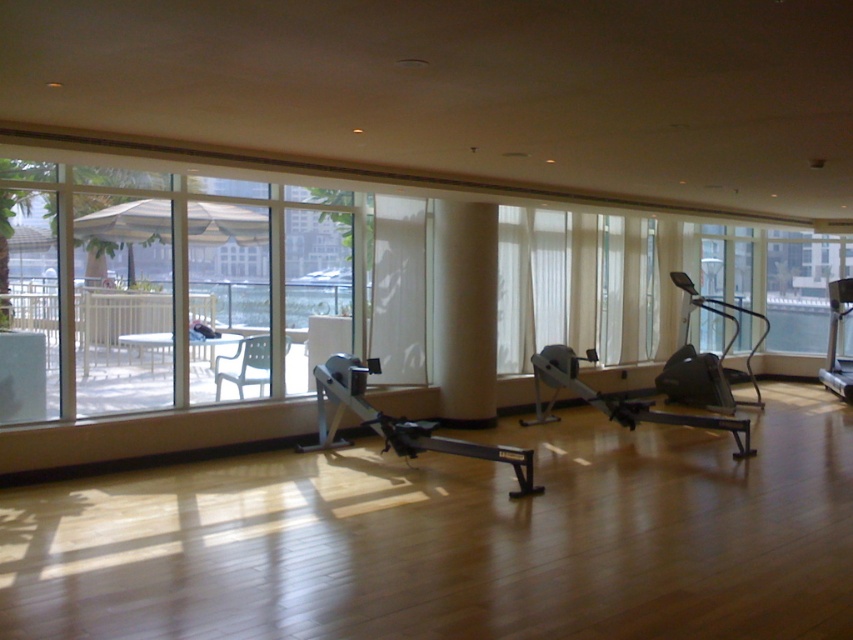
Question: Which object is farther from the camera taking this photo?

Choices:
 (A) matte black rowing machine at center
 (B) silver metallic treadmill at right
 (C) silver metallic rowing machine at center
 (D) white sheer curtain at center

Answer: (B)

Question: Considering the relative positions of silver metallic rowing machine at center and matte black rowing machine at center in the image provided, where is silver metallic rowing machine at center located with respect to matte black rowing machine at center?

Choices:
 (A) above
 (B) below

Answer: (B)

Question: Can you confirm if matte black rowing machine at center is positioned above silver metallic treadmill at right?

Choices:
 (A) no
 (B) yes

Answer: (A)

Question: Is matte black rowing machine at center smaller than silver metallic treadmill at right?

Choices:
 (A) yes
 (B) no

Answer: (B)

Question: Which of these objects is positioned closest to the silver metallic treadmill at right?

Choices:
 (A) matte black rowing machine at center
 (B) silver metallic rowing machine at center
 (C) white sheer curtain at center

Answer: (A)

Question: Which is nearer to the silver metallic rowing machine at center?

Choices:
 (A) matte black rowing machine at center
 (B) white sheer curtain at center
 (C) silver metallic treadmill at right

Answer: (B)